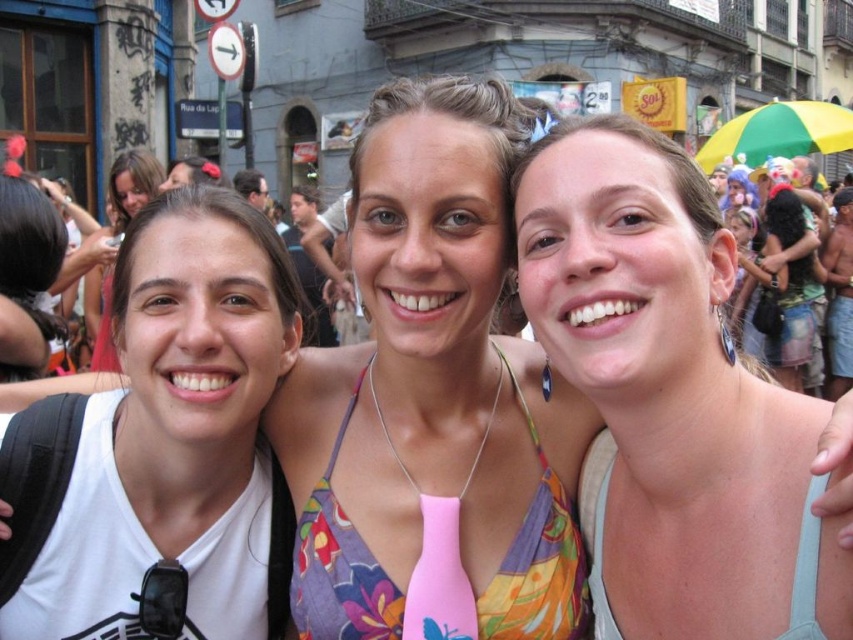
Question: Can you confirm if pink fabric top at center is positioned below matte white tank top at left?

Choices:
 (A) yes
 (B) no

Answer: (A)

Question: Is pink fabric top at center smaller than matte white tank top at left?

Choices:
 (A) yes
 (B) no

Answer: (B)

Question: Which point is farther to the camera?

Choices:
 (A) (608, 147)
 (B) (103, 292)

Answer: (B)

Question: Is pink fabric top at center closer to camera compared to matte white tank top at left?

Choices:
 (A) no
 (B) yes

Answer: (B)

Question: Which point is closer to the camera?

Choices:
 (A) (103, 326)
 (B) (820, 632)

Answer: (B)

Question: Which of the following is the farthest from the observer?

Choices:
 (A) matte white tank top at left
 (B) pink fabric top at center

Answer: (A)